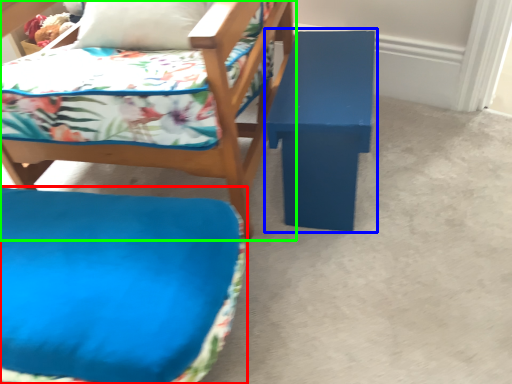
Question: Considering the real-world distances, which object is closest to furniture (highlighted by a red box)? table (highlighted by a blue box) or chair (highlighted by a green box).

Choices:
 (A) table
 (B) chair

Answer: (B)